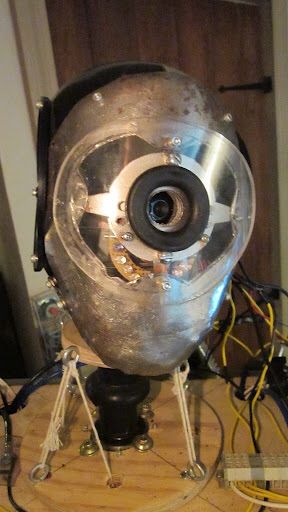
Where is `wooden door`? This screenshot has height=512, width=288. wooden door is located at coordinates (236, 53).